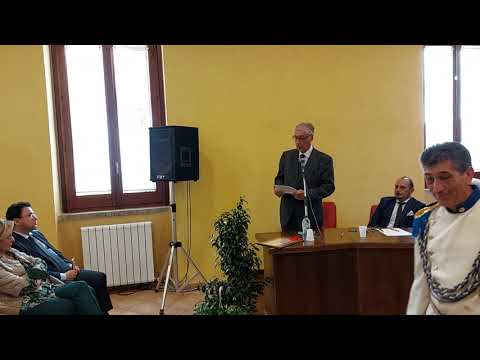
At what (x,y) coordinates should I click in order to perform the action: click on desk. Please return your answer as a coordinate pair (x, y). The width and height of the screenshot is (480, 360). Looking at the image, I should click on (349, 269).